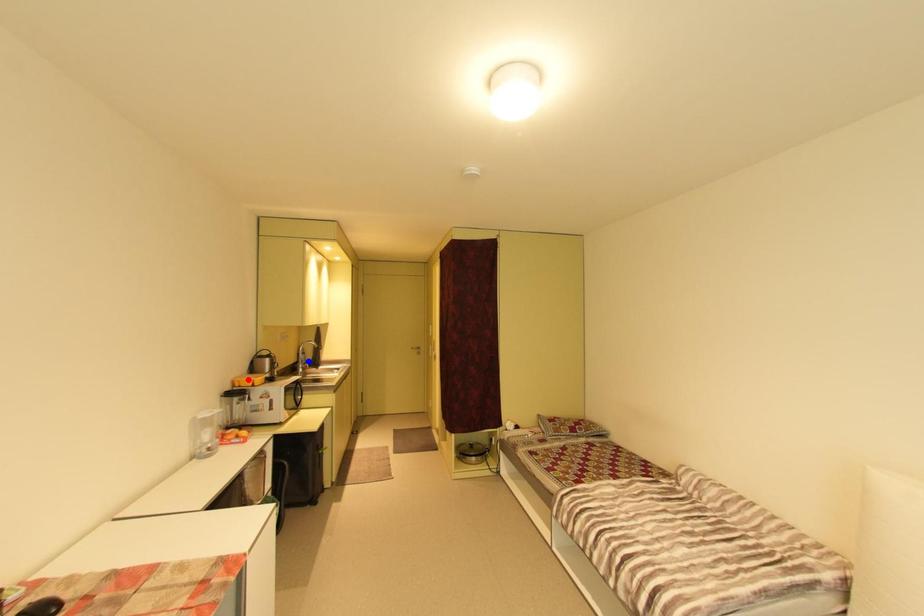
Question: Which of the two points in the image is closer to the camera?

Choices:
 (A) Blue point is closer.
 (B) Red point is closer.

Answer: (B)